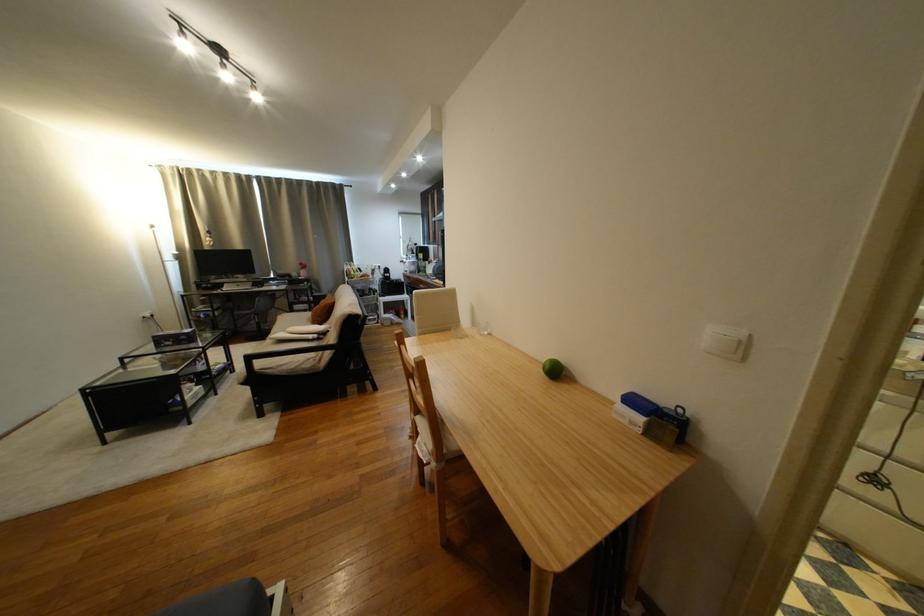
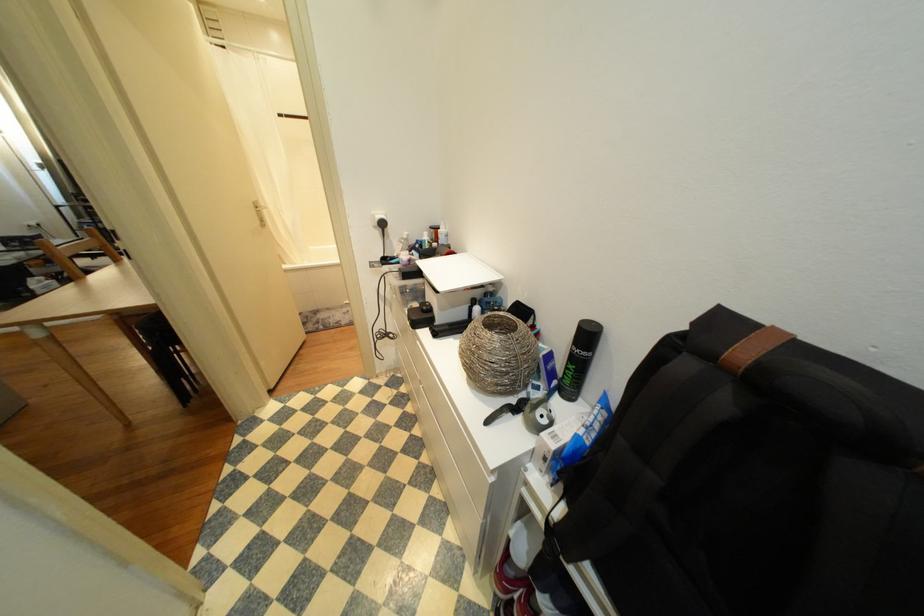
Question: Which direction would the cameraman need to move to produce the second image? Reply with the corresponding letter.

Choices:
 (A) Left
 (B) Right
 (C) Forward
 (D) Backward

Answer: (B)